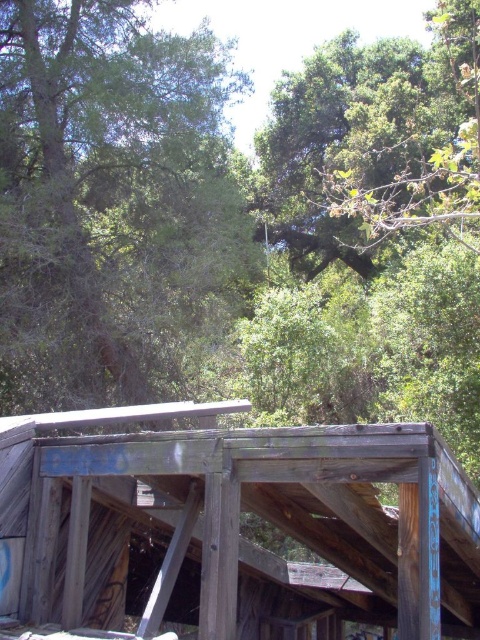
Is weathered wood shelter at center bigger than green leafy tree at upper center?

Yes, weathered wood shelter at center is bigger than green leafy tree at upper center.

Between weathered wood shelter at center and green leafy tree at upper center, which one has more height?

weathered wood shelter at center is taller.

What do you see at coordinates (233, 524) in the screenshot? The image size is (480, 640). I see `weathered wood shelter at center` at bounding box center [233, 524].

You are a GUI agent. You are given a task and a screenshot of the screen. Output one action in this format:
    pyautogui.click(x=<x>, y=<y>)
    Task: Click on the weathered wood shelter at center
    This screenshot has height=640, width=480.
    Given the screenshot: What is the action you would take?
    pyautogui.click(x=233, y=524)